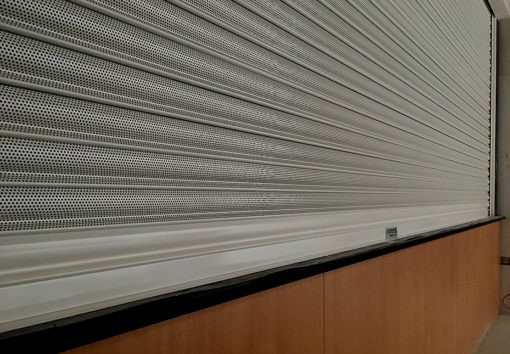
The width and height of the screenshot is (510, 354). Identify the location of sticker. (391, 234).